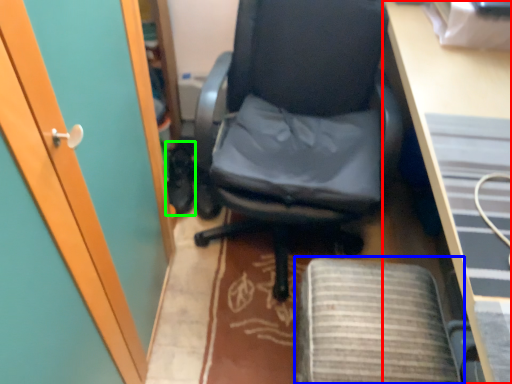
Question: Considering the real-world distances, which object is closest to desk (highlighted by a red box)? computer chair (highlighted by a blue box) or footwear (highlighted by a green box).

Choices:
 (A) computer chair
 (B) footwear

Answer: (A)